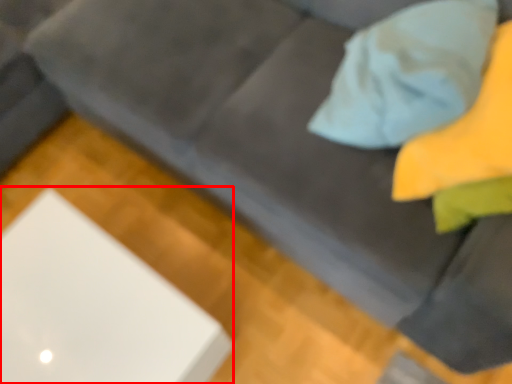
Question: From the image, what is the correct spatial relationship of computer (annotated by the red box) in relation to throw pillow?

Choices:
 (A) right
 (B) left

Answer: (B)